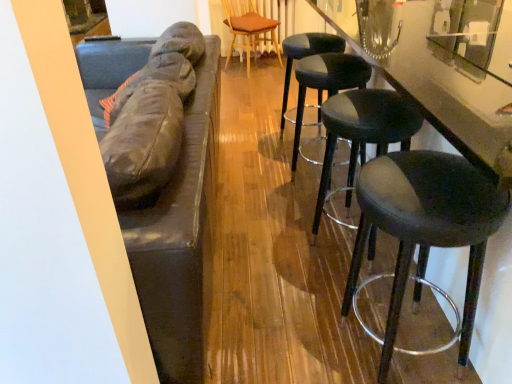
Locate an element on the screen. The width and height of the screenshot is (512, 384). blank space to the left of black leather stool at center, arranged as the 1th stool when viewed from the back is located at coordinates pos(262,144).